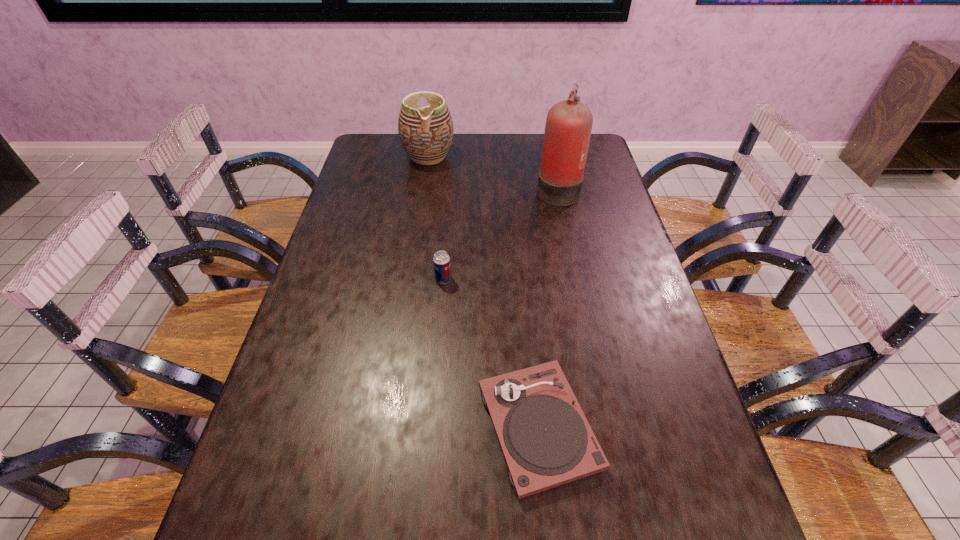
In the image, there is a desktop. Where is `vacant space at the far right corner`? vacant space at the far right corner is located at coordinates (590, 144).

Find the location of a particular element. Image resolution: width=960 pixels, height=540 pixels. free space that is in between the shortest object and the tallest object is located at coordinates (548, 307).

Image resolution: width=960 pixels, height=540 pixels. Identify the location of vacant space that is in between the shortest object and the pottery. (484, 292).

You are a GUI agent. You are given a task and a screenshot of the screen. Output one action in this format:
    pyautogui.click(x=<x>, y=<y>)
    Task: Click on the vacant point located between the shortest object and the tallest object
    This screenshot has width=960, height=540.
    Given the screenshot: What is the action you would take?
    pyautogui.click(x=548, y=307)

The height and width of the screenshot is (540, 960). Find the location of `vacant point located between the third shortest object and the third tallest object`. vacant point located between the third shortest object and the third tallest object is located at coordinates (436, 218).

Identify the location of free space between the second shortest object and the nearest object. (491, 353).

Where is `vacant region between the third tallest object and the nearest object`? vacant region between the third tallest object and the nearest object is located at coordinates (491, 353).

In order to click on empty location between the phonograph_record and the second tallest object in this screenshot , I will do `click(484, 292)`.

Locate an element on the screen. This screenshot has width=960, height=540. free point between the pottery and the nearest object is located at coordinates (484, 292).

Locate an element on the screen. The image size is (960, 540). empty location between the shortest object and the second tallest object is located at coordinates (484, 292).